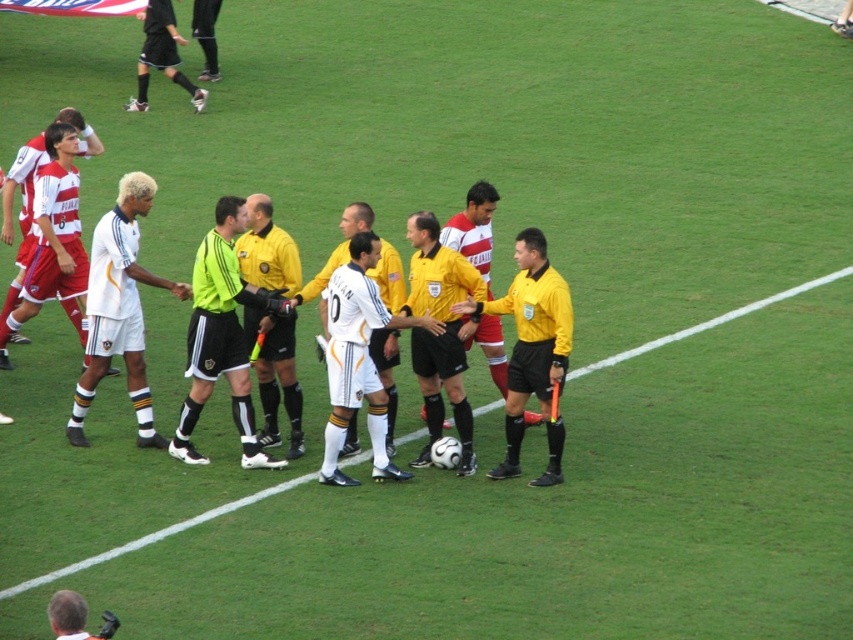
Question: Which object appears farthest from the camera in this image?

Choices:
 (A) neon yellow jersey at center
 (B) white matte soccer player at center
 (C) yellow jersey at center

Answer: (B)

Question: Does white matte soccer player at center appear on the right side of black jersey at center?

Choices:
 (A) no
 (B) yes

Answer: (B)

Question: Which point is farther to the camera?

Choices:
 (A) (543, 298)
 (B) (28, 157)

Answer: (B)

Question: Is white matte soccer ball at center to the left of matte white jersey at left from the viewer's perspective?

Choices:
 (A) yes
 (B) no

Answer: (B)

Question: Is white matte soccer player at center bigger than yellow jersey at center?

Choices:
 (A) no
 (B) yes

Answer: (B)

Question: Estimate the real-world distances between objects in this image. Which object is closer to the black jersey at center?

Choices:
 (A) yellow jersey at center
 (B) yellow/black uniform at center
 (C) matte white jersey at left
 (D) white matte soccer player at center

Answer: (C)